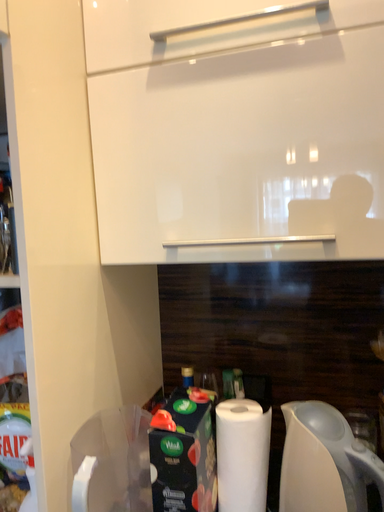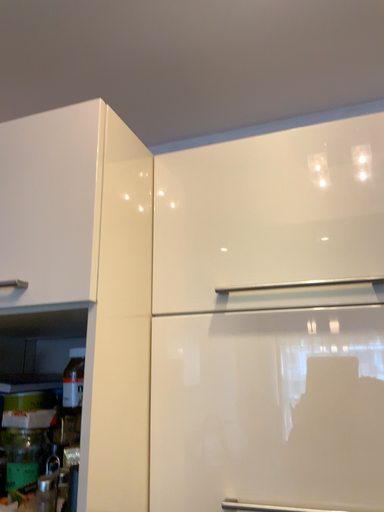
Question: Which way did the camera rotate in the video?

Choices:
 (A) rotated downward
 (B) rotated upward

Answer: (B)